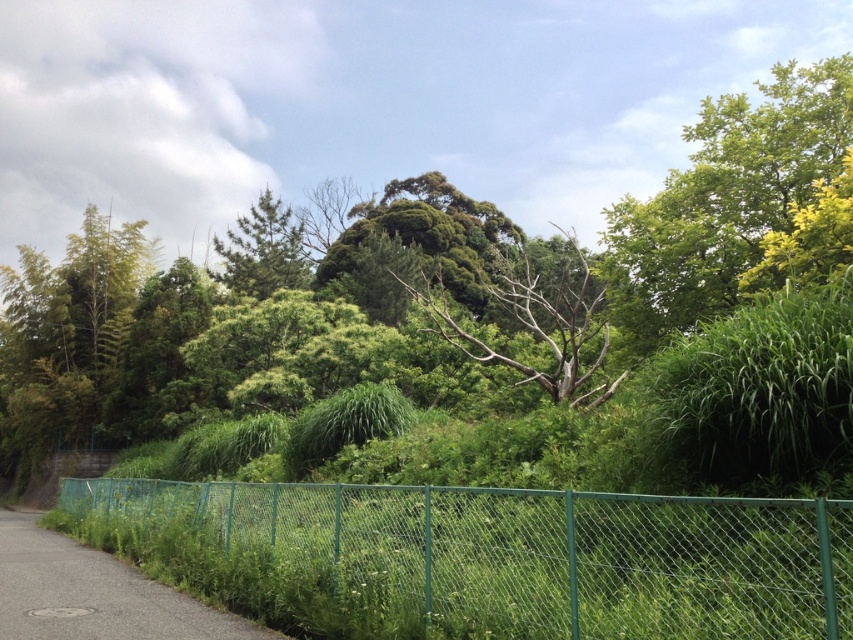
Question: Estimate the real-world distances between objects in this image. Which object is farther from the green matte tree at center?

Choices:
 (A) bare wood tree at center
 (B) asphalt road at lower left

Answer: (B)

Question: Is green leafy tree at center bigger than bare wood tree at center?

Choices:
 (A) no
 (B) yes

Answer: (B)

Question: Which of the following is the farthest from the observer?

Choices:
 (A) [x=0, y=596]
 (B) [x=804, y=118]
 (C) [x=550, y=326]

Answer: (C)

Question: Does green leafy tree at center have a smaller size compared to bare wood tree at center?

Choices:
 (A) yes
 (B) no

Answer: (B)

Question: Considering the relative positions of green leafy tree at upper right and green matte tree at center in the image provided, where is green leafy tree at upper right located with respect to green matte tree at center?

Choices:
 (A) right
 (B) left

Answer: (A)

Question: Which point is farther to the camera?

Choices:
 (A) green matte tree at center
 (B) green leafy tree at upper right

Answer: (A)